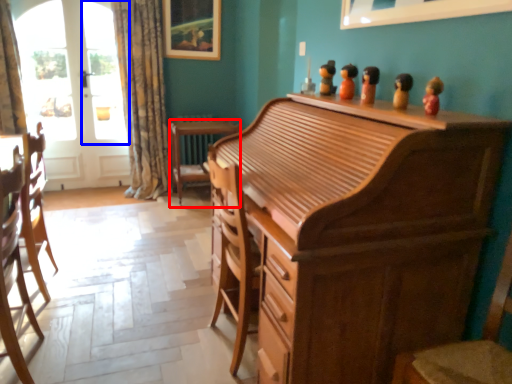
Question: Among these objects, which one is nearest to the camera, desk (highlighted by a red box) or window screen (highlighted by a blue box)?

Choices:
 (A) desk
 (B) window screen

Answer: (A)